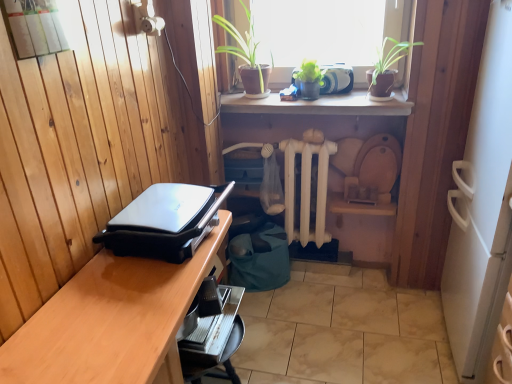
Locate an element on the screen. Image resolution: width=512 pixels, height=384 pixels. empty space that is ontop of wooden desk at lower left (from a real-world perspective) is located at coordinates (133, 297).